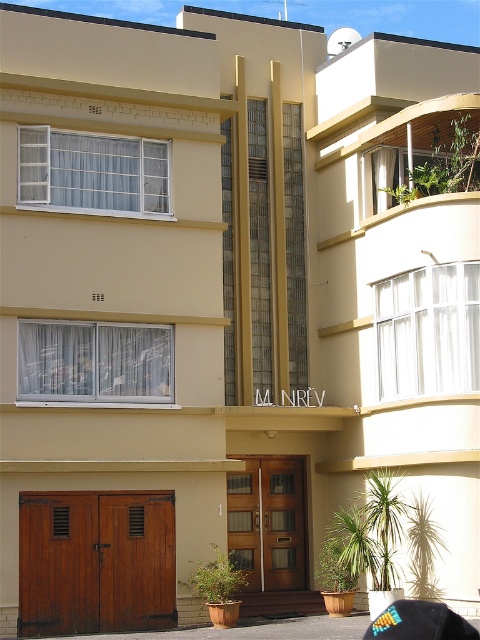
Does point (61, 566) come behind point (420, 634)?

Yes.

Based on the photo, between wooden at lower left and multicolored fabric baseball cap at lower right, which one has more height?

multicolored fabric baseball cap at lower right is taller.

Locate an element on the screen. This screenshot has height=640, width=480. wooden at lower left is located at coordinates (96, 563).

Is wooden at lower left wider than brown wooden door at lower left?

Yes, wooden at lower left is wider than brown wooden door at lower left.

Identify the location of wooden at lower left. (96, 563).

Find the location of `wooden at lower left`. wooden at lower left is located at coordinates (96, 563).

Between brown wooden door at lower left and multicolored fabric baseball cap at lower right, which one is positioned higher?

Positioned higher is multicolored fabric baseball cap at lower right.

Based on the photo, which of these two, brown wooden door at lower left or multicolored fabric baseball cap at lower right, stands shorter?

brown wooden door at lower left is shorter.

This screenshot has height=640, width=480. Identify the location of brown wooden door at lower left. (267, 522).